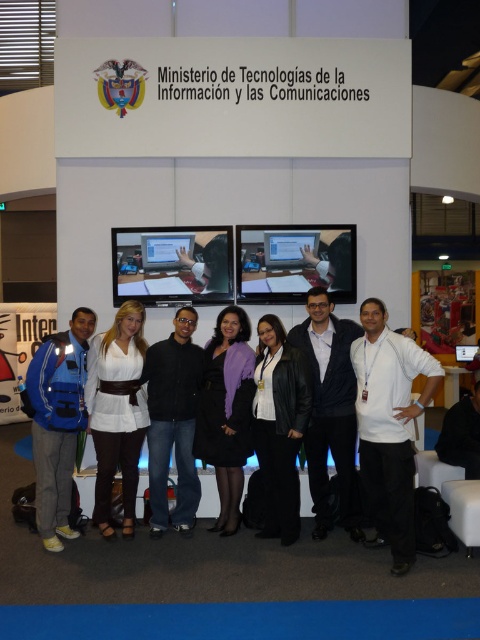
Is point (60, 376) more distant than point (204, 449)?

No, it is in front of (204, 449).

What do you see at coordinates (58, 422) in the screenshot? The width and height of the screenshot is (480, 640). I see `blue fabric backpack at left` at bounding box center [58, 422].

Image resolution: width=480 pixels, height=640 pixels. What are the coordinates of `blue fabric backpack at left` in the screenshot? It's located at (58, 422).

In the scene shown: Does white matte shirt at right have a greater width compared to black leather jacket at center?

Yes.

Between white matte shirt at right and black leather jacket at center, which one appears on the right side from the viewer's perspective?

white matte shirt at right

Find the location of `white matte shirt at right`. white matte shirt at right is located at coordinates pos(388,426).

The height and width of the screenshot is (640, 480). I want to click on white matte shirt at right, so click(388, 426).

Can you confirm if white matte shirt at right is thinner than black matte shirt at center?

No.

Is white matte shirt at right wider than black matte shirt at center?

Correct, the width of white matte shirt at right exceeds that of black matte shirt at center.

Is point (418, 404) closer to camera compared to point (152, 528)?

That is True.

Where is `white matte shirt at right`? This screenshot has width=480, height=640. white matte shirt at right is located at coordinates (388, 426).